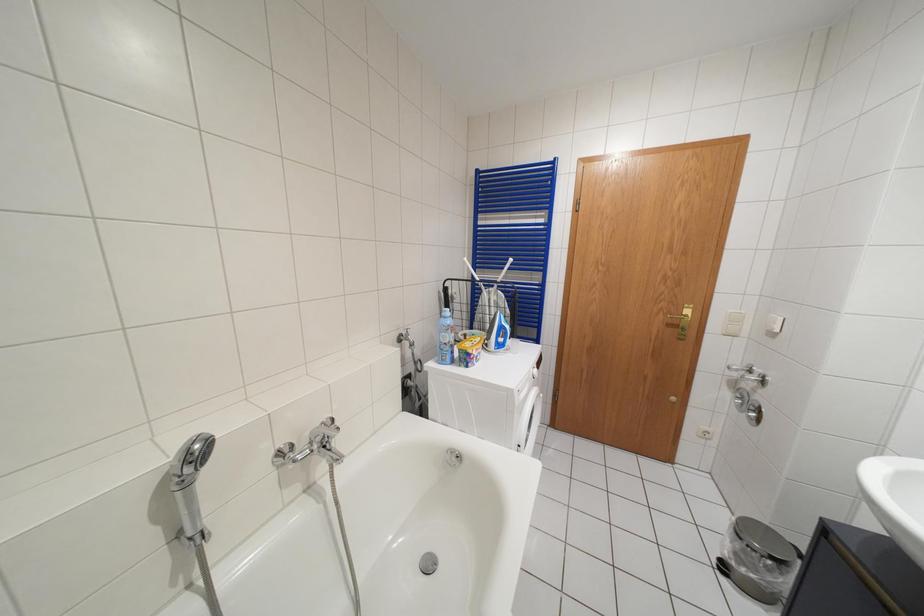
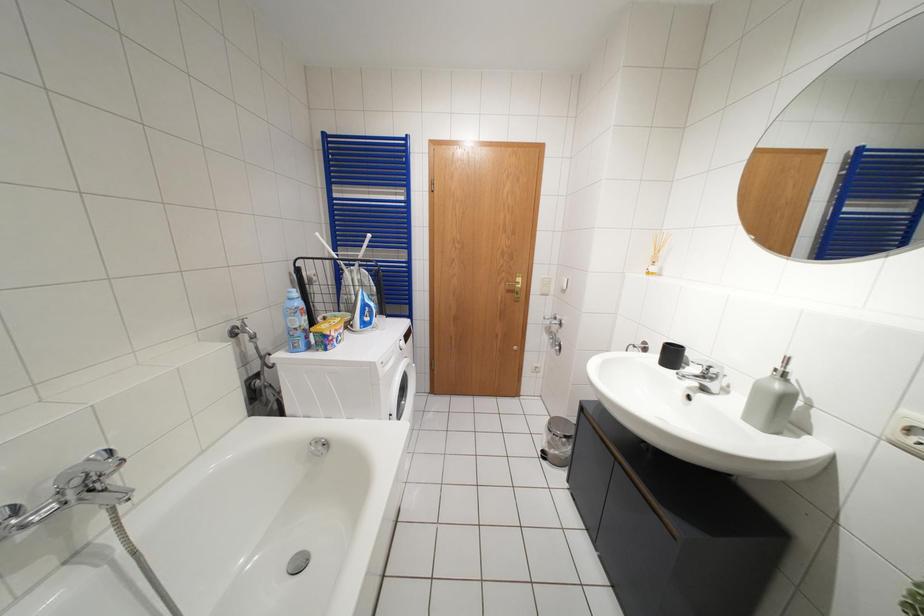
The images are taken continuously from a first-person perspective. In which direction are you moving?

The cameraman moved toward right, backward.